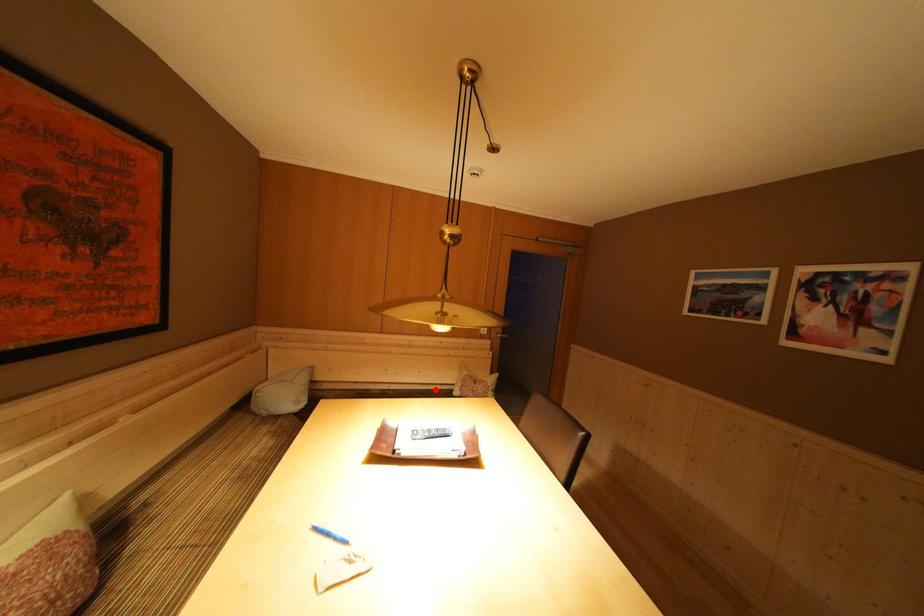
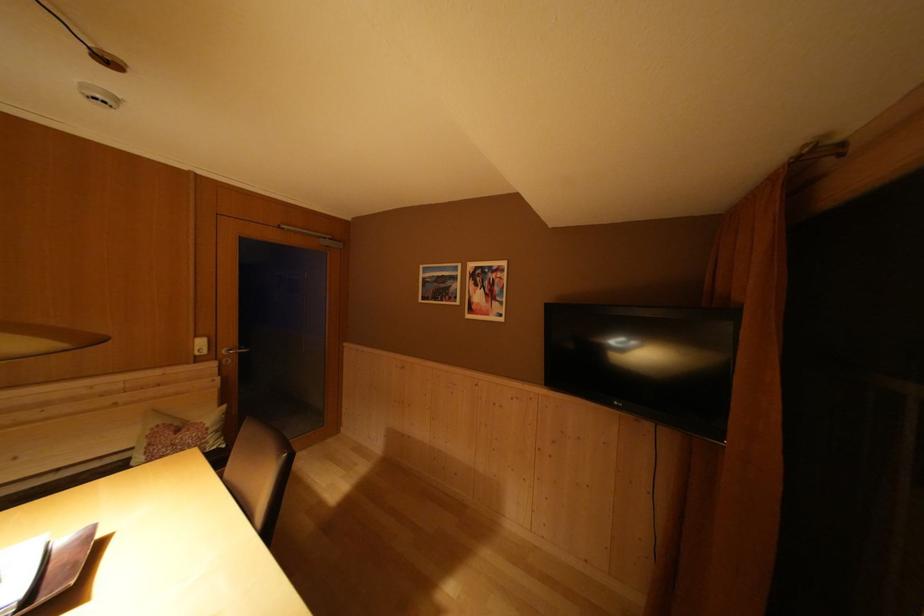
Locate, in the second image, the point that corresponds to the highlighted location in the first image.

(66, 475)